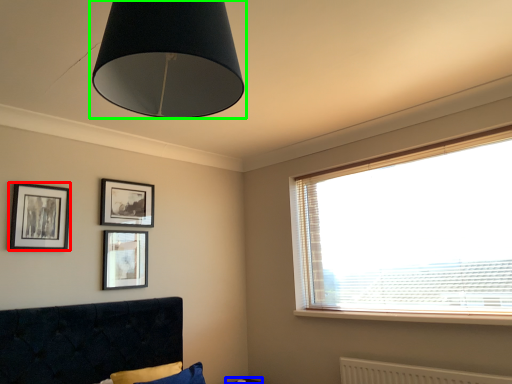
Question: Considering the real-world distances, which object is closest to picture frame (highlighted by a red box)? table (highlighted by a blue box) or lamp (highlighted by a green box).

Choices:
 (A) table
 (B) lamp

Answer: (B)